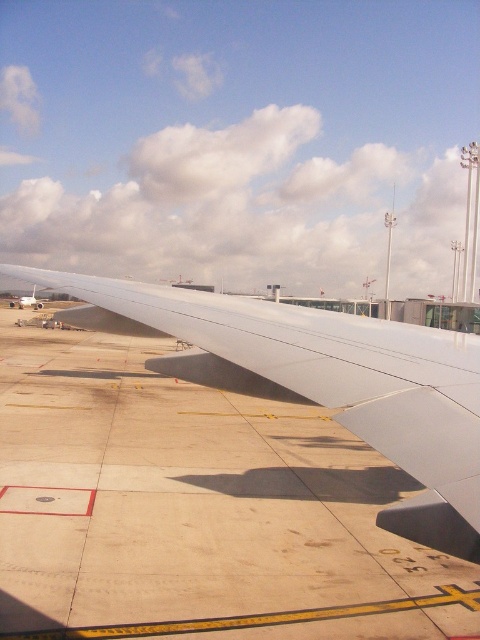
Question: Which of the following is the farthest from the observer?

Choices:
 (A) white matte wing at center
 (B) white matte airplane wing at lower left

Answer: (B)

Question: In this image, where is white matte wing at center located relative to white matte airplane wing at lower left?

Choices:
 (A) right
 (B) left

Answer: (A)

Question: Does white matte wing at center appear on the right side of white matte airplane wing at lower left?

Choices:
 (A) yes
 (B) no

Answer: (A)

Question: Can you confirm if white matte wing at center is positioned below white matte airplane wing at lower left?

Choices:
 (A) yes
 (B) no

Answer: (A)

Question: Which of the following is the closest to the observer?

Choices:
 (A) white matte airplane wing at lower left
 (B) white matte wing at center

Answer: (B)